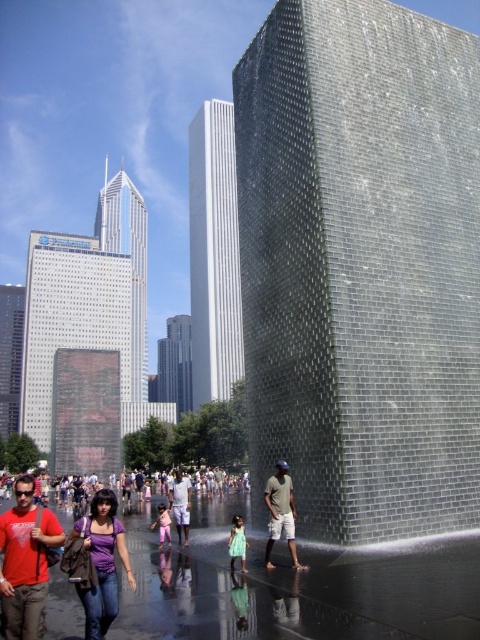
Which is more to the left, matte green t-shirt at center or light purple shirt at center?

Positioned to the left is light purple shirt at center.

Which is more to the right, matte green t-shirt at center or light purple shirt at center?

matte green t-shirt at center is more to the right.

Find the location of a particular element. matte green t-shirt at center is located at coordinates (280, 513).

Identify the location of purple matte shirt at center. This screenshot has width=480, height=640. (101, 563).

Does point (101, 502) lie in front of point (241, 570)?

Yes, point (101, 502) is in front of point (241, 570).

This screenshot has width=480, height=640. I want to click on purple matte shirt at center, so click(x=101, y=563).

Does teal fabric dress at center have a larger size compared to pink fabric dress at center?

Incorrect, teal fabric dress at center is not larger than pink fabric dress at center.

Can you confirm if teal fabric dress at center is positioned above pink fabric dress at center?

Indeed, teal fabric dress at center is positioned over pink fabric dress at center.

What do you see at coordinates (237, 541) in the screenshot? This screenshot has height=640, width=480. I see `teal fabric dress at center` at bounding box center [237, 541].

The image size is (480, 640). I want to click on teal fabric dress at center, so click(237, 541).